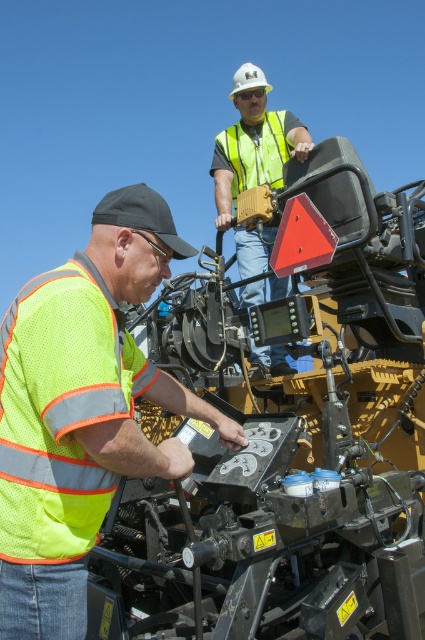
You are a safety inspector checking the machinery. You notice a point at coordinates (82, 410). What object is located at that point?

The point at coordinates (82, 410) indicates the neon yellow safety vest at lower left.

You are standing at the camera position and want to pick up the neon yellow safety vest at lower left. Can you reach it without moving your feet?

The neon yellow safety vest at lower left is 3.93 feet away from the camera. Since the average human arm length is about 2.5 feet, you cannot reach it without moving your feet.

You are standing in front of the machinery and see two points marked on it. Which point is closer to you, point (44, 316) or point (221, 150)?

Point (44, 316) is closer to the viewer than point (221, 150).